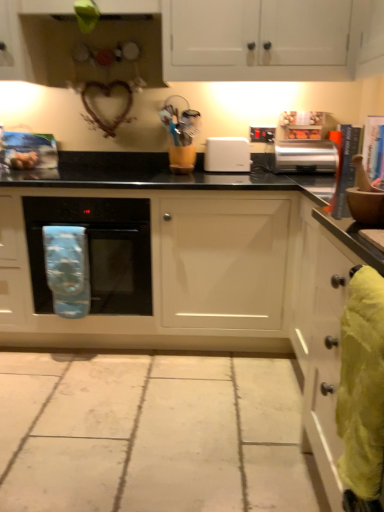
Question: From the image's perspective, is satin silver toaster at upper right beneath yellow fabric towel at right, which appears as the second material when viewed from the back?

Choices:
 (A) yes
 (B) no

Answer: (B)

Question: Considering the relative sizes of satin silver toaster at upper right and yellow fabric towel at right, marked as the 1th material in a right-to-left arrangement, in the image provided, is satin silver toaster at upper right taller than yellow fabric towel at right, marked as the 1th material in a right-to-left arrangement,?

Choices:
 (A) yes
 (B) no

Answer: (B)

Question: Is satin silver toaster at upper right oriented away from yellow fabric towel at right, marked as the 1th material in a right-to-left arrangement?

Choices:
 (A) no
 (B) yes

Answer: (A)

Question: Is satin silver toaster at upper right positioned beyond the bounds of yellow fabric towel at right, the 1th material positioned from the front?

Choices:
 (A) no
 (B) yes

Answer: (B)

Question: Considering the relative sizes of satin silver toaster at upper right and yellow fabric towel at right, the second material from the left, in the image provided, is satin silver toaster at upper right shorter than yellow fabric towel at right, the second material from the left,?

Choices:
 (A) yes
 (B) no

Answer: (A)

Question: From a real-world perspective, is satin silver toaster at upper right located beneath yellow fabric towel at right, which appears as the second material when viewed from the back?

Choices:
 (A) yes
 (B) no

Answer: (B)

Question: Is white matte cabinet at center, the second cabinetry ordered from the bottom, a part of satin silver toaster at upper right?

Choices:
 (A) yes
 (B) no

Answer: (B)

Question: Considering the relative positions of satin silver toaster at upper right and white matte cabinet at center, the second cabinetry ordered from the bottom, in the image provided, is satin silver toaster at upper right to the right of white matte cabinet at center, the second cabinetry ordered from the bottom, from the viewer's perspective?

Choices:
 (A) no
 (B) yes

Answer: (B)

Question: Is satin silver toaster at upper right not close to white matte cabinet at center, the second cabinetry ordered from the bottom?

Choices:
 (A) yes
 (B) no

Answer: (B)

Question: Can you confirm if satin silver toaster at upper right is shorter than white matte cabinet at center, the second cabinetry ordered from the bottom?

Choices:
 (A) no
 (B) yes

Answer: (B)

Question: Does satin silver toaster at upper right have a smaller size compared to white matte cabinet at center, acting as the second cabinetry starting from the top?

Choices:
 (A) yes
 (B) no

Answer: (A)

Question: Does satin silver toaster at upper right come behind white matte cabinet at center, the second cabinetry ordered from the bottom?

Choices:
 (A) no
 (B) yes

Answer: (B)

Question: From the image's perspective, is white matte cabinet at upper center, which is counted as the 3th cabinetry, starting from the bottom, on top of yellow fabric towel at right, the second material from the left?

Choices:
 (A) no
 (B) yes

Answer: (B)